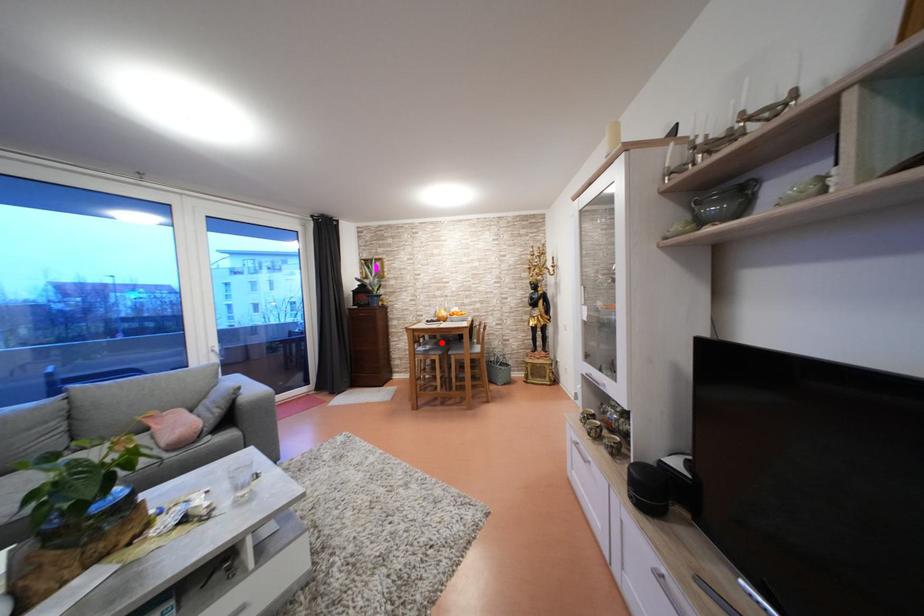
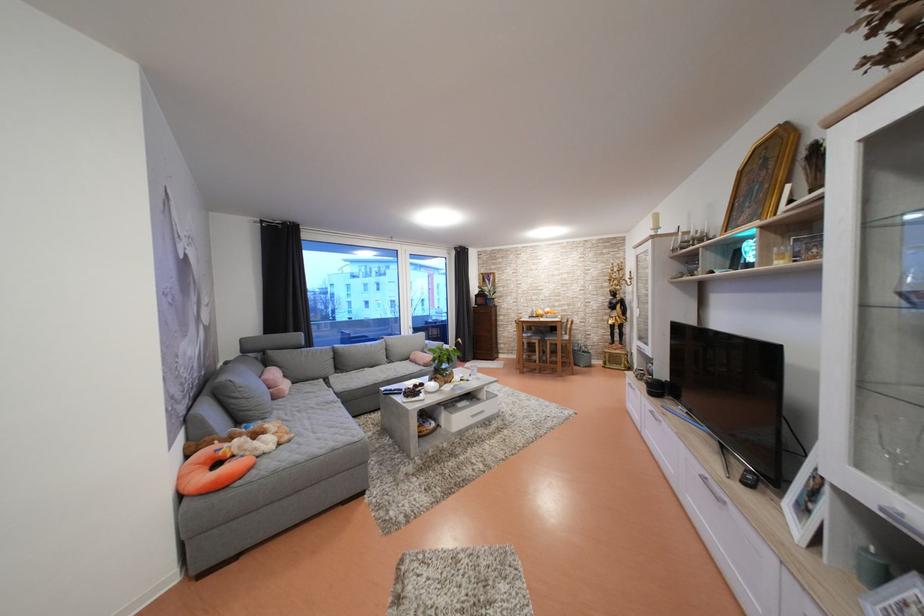
Locate, in the second image, the point that corresponds to the highlighted location in the first image.

(538, 334)